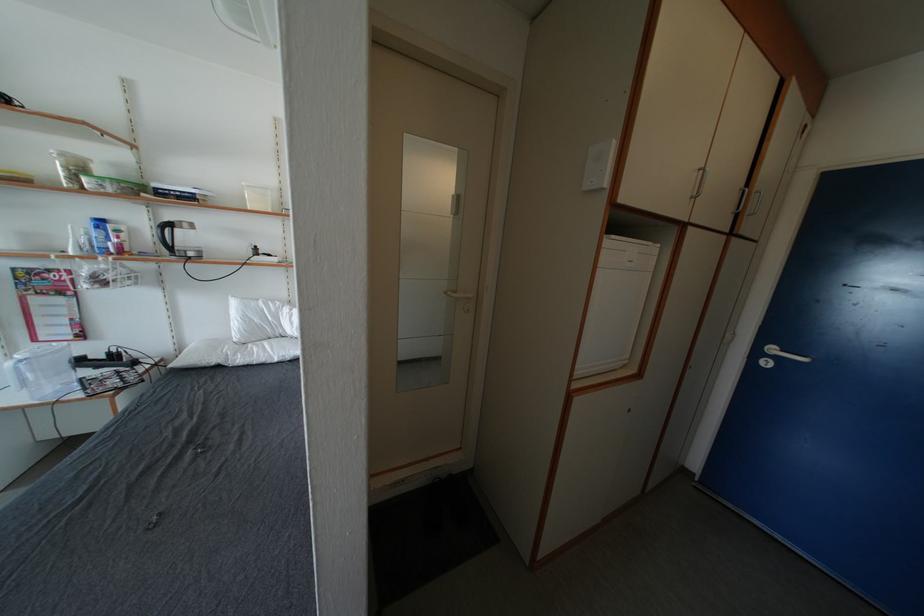
What do you see at coordinates (462, 298) in the screenshot? I see `the white door handle` at bounding box center [462, 298].